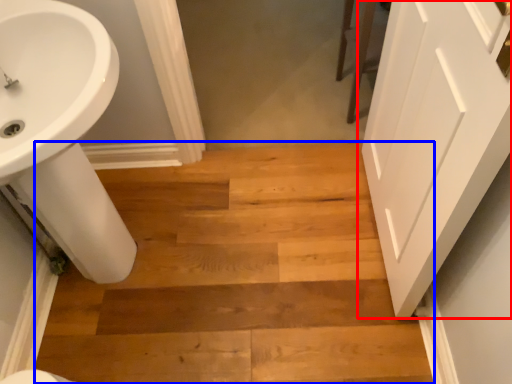
Question: Which point is further to the camera, door (highlighted by a red box) or stairwell (highlighted by a blue box)?

Choices:
 (A) door
 (B) stairwell

Answer: (B)